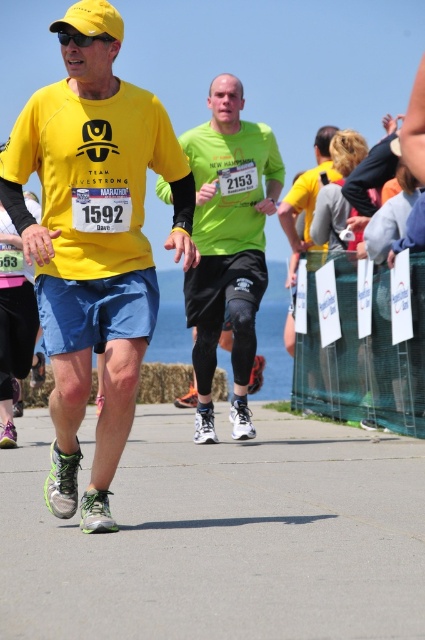
You are a photographer at the marathon event. You want to capture a photo that includes both the green matte running shirt at center and the matte yellow shirt at center. Which shirt should you focus on to ensure both are in frame if your camera has limited zoom capability?

The green matte running shirt at center has a larger size compared to the matte yellow shirt at center, so focusing on the green matte running shirt at center will help ensure both shirts are in frame as it takes up more space and can be positioned centrally while the smaller yellow shirt remains visible.